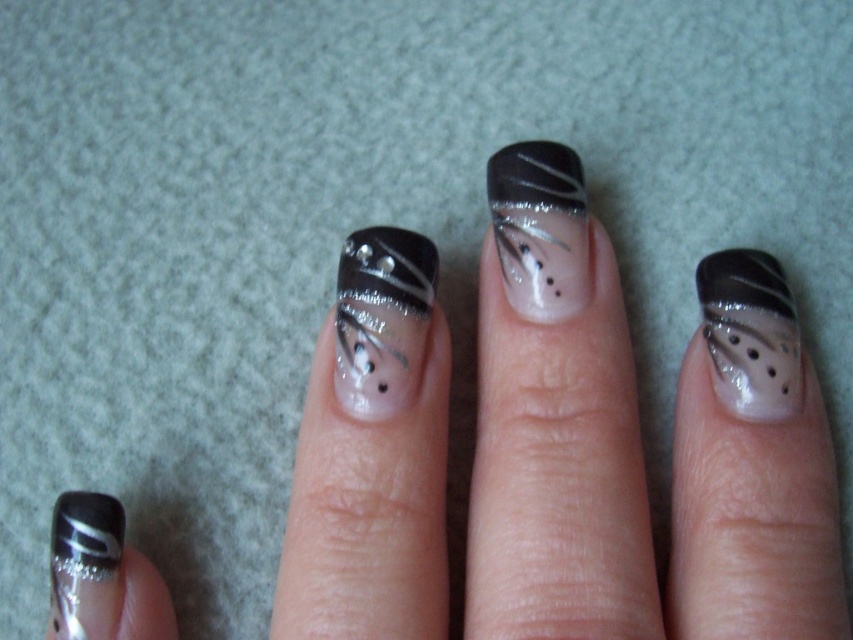
You are an artist trying to replicate the nail art design. You have two reference points marked as point 1 at coordinates point (363, 328) and point 2 at coordinates point (68, 525). Which point is closer to the viewer?

Point (68, 525) is closer to the viewer because point (363, 328) is behind it.

Based on the photo, you are holding a small 10 inch ruler. You want to measure the distance from your eye to the point at coordinates point (730, 362). Can you reach the point with your ruler?

The point at coordinates point (730, 362) is 33.16 inches from the viewer. Since the ruler is only 10 inches long, it cannot reach that distance. You need a longer measuring tool.

You are a nail technician assessing a client with two black nail designs on their hand. The designs are the satin black nail at center and the matte black nail art at center. Which of these two has a larger surface area?

The satin black nail at center is bigger than the matte black nail art at center, so it has a larger surface area.